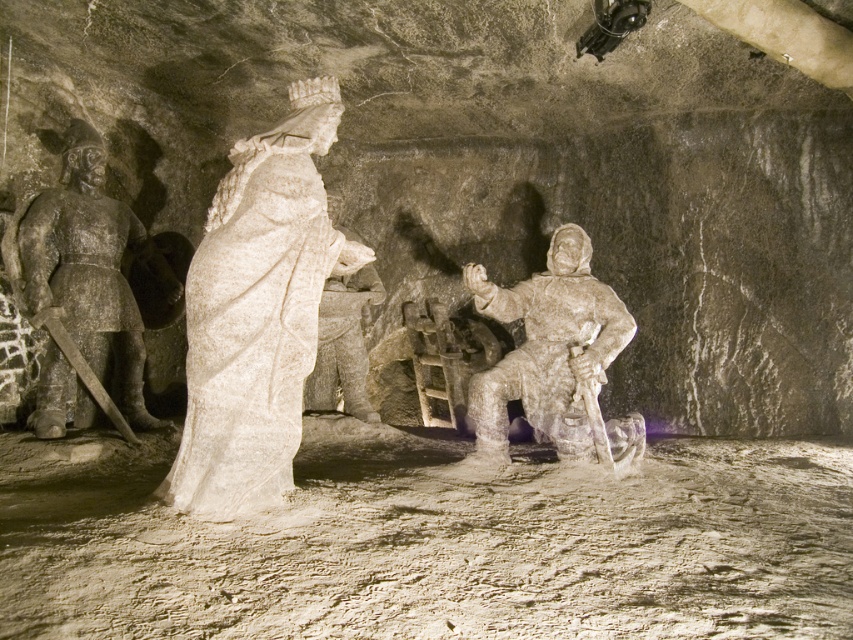
You are standing at the point marked as point (120, 403) in the salt mine scene. You want to light a torch to illuminate the area. The nearest available torch is placed at the entrance, which is 6 meters away from your current position. Can you reach the torch without moving more than 5.65 meters?

The distance between you and the viewer is 5.65 meters, but the torch is 6 meters away. Since 6 meters exceeds the 5.65 meters limit, you cannot reach the torch without moving more than the allowed distance.

From the picture: You are an archaeologist examining the salt mine carving. You notice the dark gray stone warrior at left and the translucent white stone warrior at center. Which warrior is positioned closer to the entrance of the cave?

The dark gray stone warrior at left is positioned closer to the entrance of the cave because it is to the left of the translucent white stone warrior at center, implying it is nearer the entrance based on their arrangement.